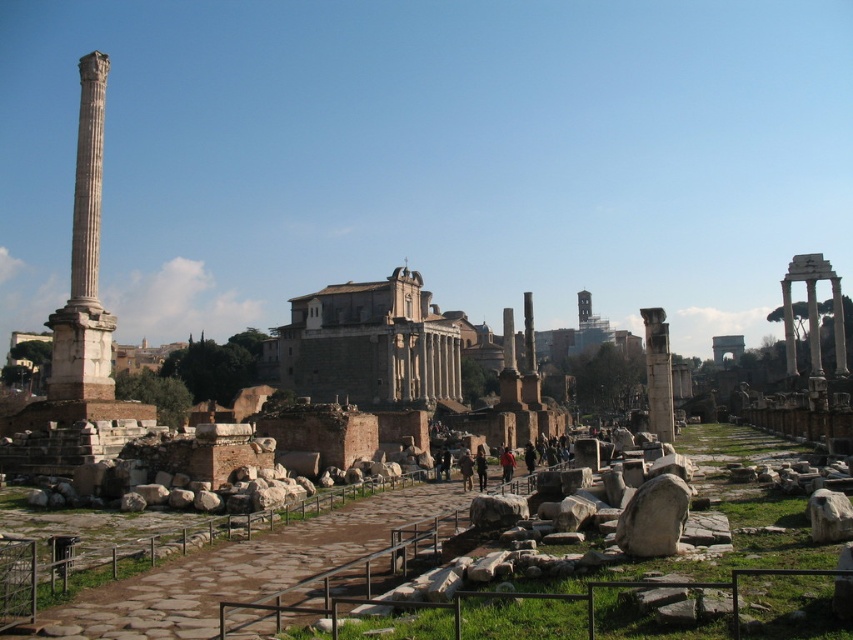
Question: Is smooth gray stone temple at center bigger than smooth stone column at left?

Choices:
 (A) no
 (B) yes

Answer: (B)

Question: Which object appears closest to the camera in this image?

Choices:
 (A) smooth stone column at center
 (B) smooth stone column at left

Answer: (B)

Question: Considering the real-world distances, which object is closest to the smooth stone column at center?

Choices:
 (A) smooth gray stone temple at center
 (B) smooth stone column at left

Answer: (B)

Question: Estimate the real-world distances between objects in this image. Which object is closer to the smooth stone column at center?

Choices:
 (A) smooth gray stone temple at center
 (B) smooth stone column at left

Answer: (B)

Question: Is smooth gray stone temple at center closer to the viewer compared to smooth stone column at center?

Choices:
 (A) no
 (B) yes

Answer: (A)

Question: In this image, where is smooth gray stone temple at center located relative to smooth stone column at left?

Choices:
 (A) above
 (B) below

Answer: (B)